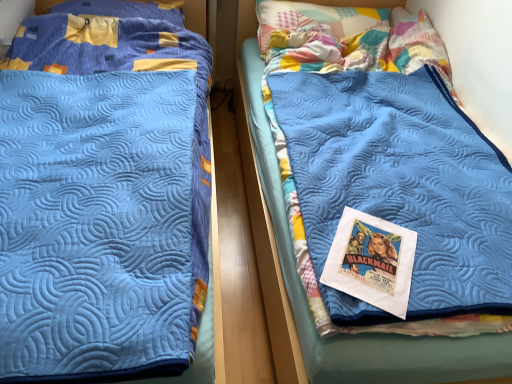
Question: Is yellow fabric pillow at upper left, which is the second pillow from right to left, next to patchwork fabric pillow at upper center, the 1th pillow positioned from the right, and touching it?

Choices:
 (A) yes
 (B) no

Answer: (B)

Question: Is yellow fabric pillow at upper left, which is the second pillow from right to left, positioned in front of patchwork fabric pillow at upper center, the 2th pillow when ordered from left to right?

Choices:
 (A) yes
 (B) no

Answer: (B)

Question: From the image's perspective, is yellow fabric pillow at upper left, which is the second pillow from right to left, above patchwork fabric pillow at upper center, the 1th pillow positioned from the right?

Choices:
 (A) no
 (B) yes

Answer: (B)

Question: Does yellow fabric pillow at upper left, which ranks as the 1th pillow in left-to-right order, have a greater width compared to patchwork fabric pillow at upper center, the 2th pillow when ordered from left to right?

Choices:
 (A) no
 (B) yes

Answer: (A)

Question: Does yellow fabric pillow at upper left, which ranks as the 1th pillow in left-to-right order, appear on the right side of patchwork fabric pillow at upper center, the 1th pillow positioned from the right?

Choices:
 (A) no
 (B) yes

Answer: (A)

Question: Considering the positions of point (309, 11) and point (429, 342), is point (309, 11) closer or farther from the camera than point (429, 342)?

Choices:
 (A) farther
 (B) closer

Answer: (A)

Question: From the image's perspective, relative to blue quilted blanket at center, which ranks as the 1th bed in right-to-left order, is patchwork fabric pillow at upper center, the 2th pillow when ordered from left to right, above or below?

Choices:
 (A) above
 (B) below

Answer: (A)

Question: In the image, is patchwork fabric pillow at upper center, the 1th pillow positioned from the right, positioned in front of or behind blue quilted blanket at center, the second bed positioned from the left?

Choices:
 (A) behind
 (B) front

Answer: (A)

Question: Which is correct: patchwork fabric pillow at upper center, the 1th pillow positioned from the right, is inside blue quilted blanket at center, which ranks as the 1th bed in right-to-left order, or outside of it?

Choices:
 (A) inside
 (B) outside

Answer: (A)

Question: Looking at their shapes, would you say patchwork fabric pillow at upper center, the 2th pillow when ordered from left to right, is wider or thinner than yellow fabric pillow at upper left, which ranks as the 1th pillow in left-to-right order?

Choices:
 (A) wide
 (B) thin

Answer: (A)

Question: From a real-world perspective, is patchwork fabric pillow at upper center, the 2th pillow when ordered from left to right, physically located above or below yellow fabric pillow at upper left, which is the second pillow from right to left?

Choices:
 (A) above
 (B) below

Answer: (B)

Question: From their relative heights in the image, would you say patchwork fabric pillow at upper center, the 1th pillow positioned from the right, is taller or shorter than yellow fabric pillow at upper left, which ranks as the 1th pillow in left-to-right order?

Choices:
 (A) tall
 (B) short

Answer: (A)

Question: Visually, is patchwork fabric pillow at upper center, the 2th pillow when ordered from left to right, positioned to the left or to the right of yellow fabric pillow at upper left, which ranks as the 1th pillow in left-to-right order?

Choices:
 (A) right
 (B) left

Answer: (A)

Question: Considering the positions of point (34, 34) and point (411, 261), is point (34, 34) closer or farther from the camera than point (411, 261)?

Choices:
 (A) closer
 (B) farther

Answer: (B)

Question: Looking at the image, does blue quilted blanket at left, marked as the 1th bed in a left-to-right arrangement, seem bigger or smaller compared to matte paper poster at center?

Choices:
 (A) small
 (B) big

Answer: (B)